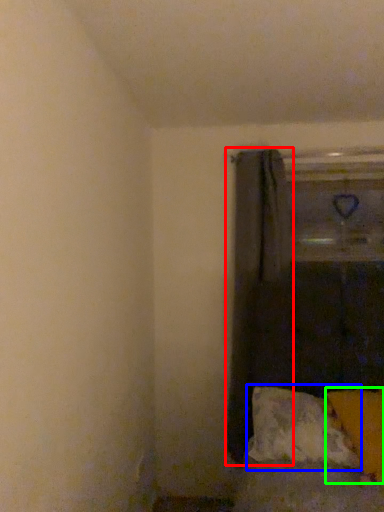
Question: Based on their relative distances, which object is farther from curtain (highlighted by a red box)? Choose from pillow (highlighted by a blue box) and pillow (highlighted by a green box).

Choices:
 (A) pillow
 (B) pillow

Answer: (B)